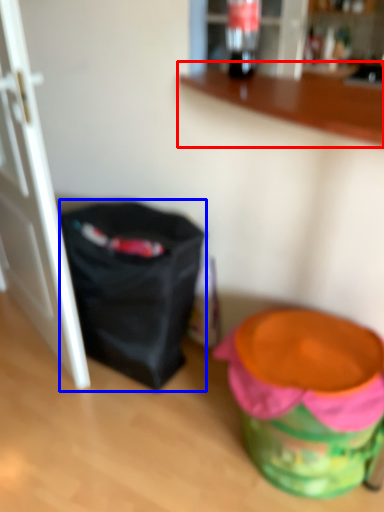
Question: Which object appears closest to the camera in this image, counter (highlighted by a red box) or bag (highlighted by a blue box)?

Choices:
 (A) counter
 (B) bag

Answer: (A)